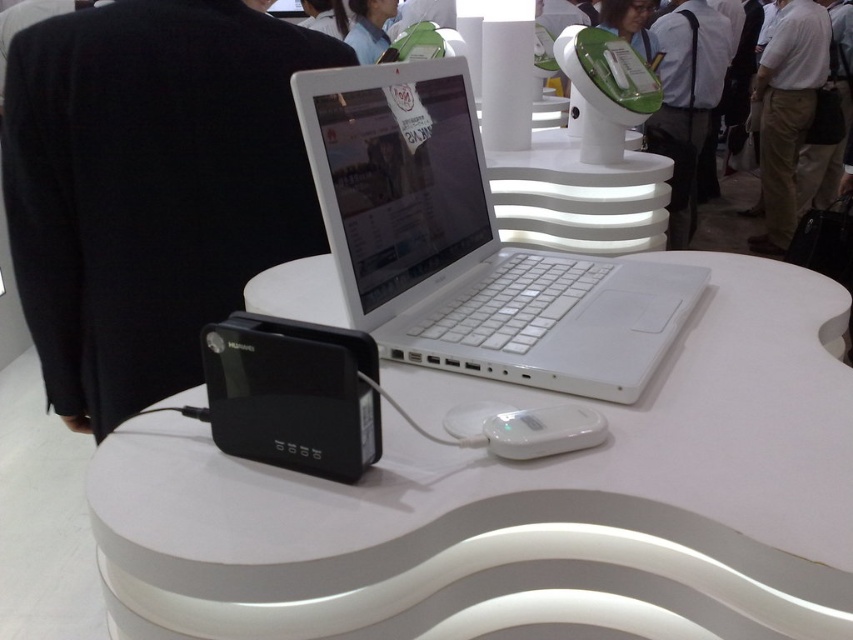
Describe the element at coordinates (521, 500) in the screenshot. I see `white glossy table at center` at that location.

Which is more to the right, white glossy table at center or black plastic router at lower left?

white glossy table at center is more to the right.

Is point (250, 509) farther from camera compared to point (222, 444)?

No, (250, 509) is closer to viewer.

Locate an element on the screen. white glossy table at center is located at coordinates coord(521,500).

Who is positioned more to the right, white plastic laptop at center or white fabric shirt at upper center?

From the viewer's perspective, white plastic laptop at center appears more on the right side.

Looking at this image, between white plastic laptop at center and white fabric shirt at upper center, which one appears on the left side from the viewer's perspective?

Positioned to the left is white fabric shirt at upper center.

The image size is (853, 640). In order to click on white plastic laptop at center in this screenshot , I will do `click(467, 244)`.

Is khaki cotton pants at center positioned in front of white fabric shirt at upper center?

No, khaki cotton pants at center is further to the viewer.

Does khaki cotton pants at center have a lesser height compared to white fabric shirt at upper center?

No.

Is point (782, 106) more distant than point (346, 19)?

Yes, point (782, 106) is farther from viewer.

Find the location of a particular element. Image resolution: width=853 pixels, height=640 pixels. khaki cotton pants at center is located at coordinates (786, 112).